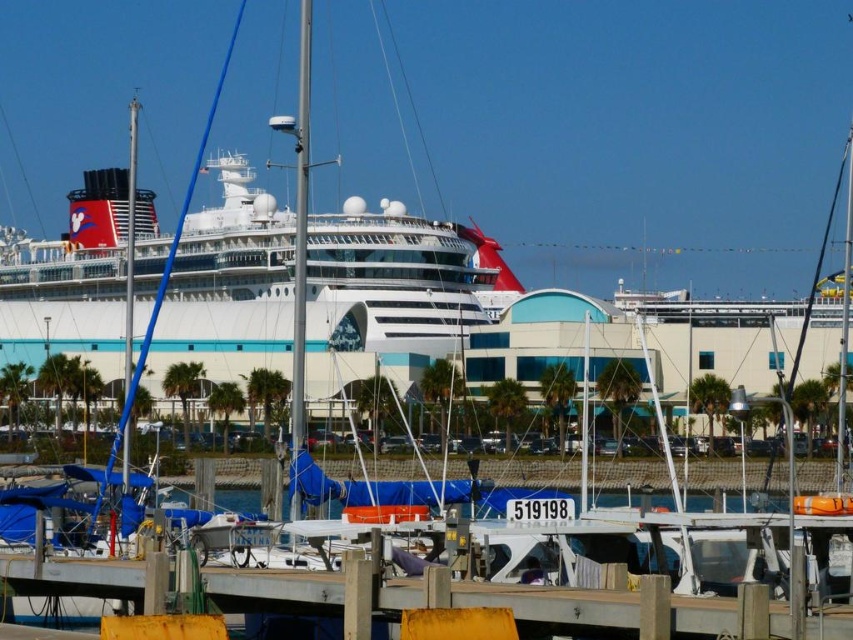
Who is higher up, white glossy cruise ship at center or yellow painted wood at lower center?

Positioned higher is white glossy cruise ship at center.

Identify the location of white glossy cruise ship at center. The image size is (853, 640). (387, 292).

What are the coordinates of `white glossy cruise ship at center` in the screenshot? It's located at (387, 292).